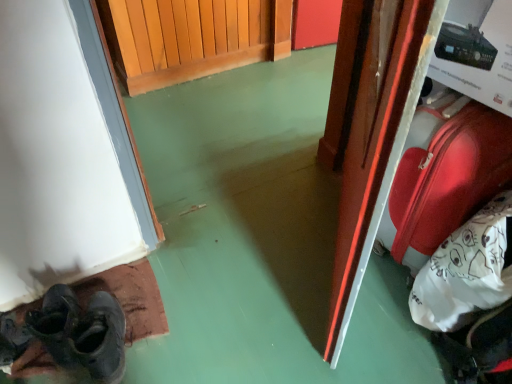
What do you see at coordinates (82, 332) in the screenshot?
I see `dark gray leather shoes at lower left` at bounding box center [82, 332].

Image resolution: width=512 pixels, height=384 pixels. What are the coordinates of `dark gray leather shoe at lower left` in the screenshot? It's located at (101, 338).

Would you say shiny red suitcase at right is a long distance from glossy wood door at right?

No, shiny red suitcase at right is in close proximity to glossy wood door at right.

Does point (418, 223) lie behind point (365, 188)?

Yes, it is.

Considering the sizes of shiny red suitcase at right and glossy wood door at right in the image, is shiny red suitcase at right wider or thinner than glossy wood door at right?

Considering their sizes, shiny red suitcase at right looks broader than glossy wood door at right.

Is dark gray leather shoe at lower left bigger or smaller than dark gray leather shoes at lower left?

Clearly, dark gray leather shoe at lower left is larger in size than dark gray leather shoes at lower left.

Considering the sizes of objects dark gray leather shoe at lower left and dark gray leather shoes at lower left in the image provided, who is wider, dark gray leather shoe at lower left or dark gray leather shoes at lower left?

With larger width is dark gray leather shoes at lower left.

From the image's perspective, which is below, dark gray leather shoe at lower left or dark gray leather shoes at lower left?

dark gray leather shoe at lower left.

From a real-world perspective, is dark gray leather shoe at lower left positioned over dark gray leather shoes at lower left based on gravity?

No.

Which object is positioned more to the right, glossy wood door at right or dark gray leather shoe at lower left?

Positioned to the right is glossy wood door at right.

Does glossy wood door at right turn towards dark gray leather shoe at lower left?

No, glossy wood door at right is not oriented towards dark gray leather shoe at lower left.

Which object is further away from the camera, glossy wood door at right or dark gray leather shoe at lower left?

dark gray leather shoe at lower left.

Considering the relative sizes of glossy wood door at right and dark gray leather shoe at lower left in the image provided, is glossy wood door at right smaller than dark gray leather shoe at lower left?

No, glossy wood door at right is not smaller than dark gray leather shoe at lower left.

Which object is positioned more to the left, shiny red suitcase at right or dark gray leather shoe at lower left?

dark gray leather shoe at lower left is more to the left.

Is shiny red suitcase at right inside the boundaries of dark gray leather shoe at lower left, or outside?

shiny red suitcase at right cannot be found inside dark gray leather shoe at lower left.

Is there a large distance between shiny red suitcase at right and dark gray leather shoe at lower left?

Actually, shiny red suitcase at right and dark gray leather shoe at lower left are a little close together.

From their relative heights in the image, would you say shiny red suitcase at right is taller or shorter than dark gray leather shoe at lower left?

Clearly, shiny red suitcase at right is taller compared to dark gray leather shoe at lower left.

Is dark gray leather shoe at lower left further to the viewer compared to shiny red suitcase at right?

Yes, it is.

How distant is dark gray leather shoe at lower left from shiny red suitcase at right?

dark gray leather shoe at lower left is 38.86 inches away from shiny red suitcase at right.

Which is closer, (113,369) or (411,159)?

Clearly, point (113,369) is closer to the camera than point (411,159).

Between dark gray leather shoe at lower left and shiny red suitcase at right, which one has smaller width?

dark gray leather shoe at lower left.

From the image's perspective, between glossy wood door at right and shiny red suitcase at right, which one is located above?

From the image's view, glossy wood door at right is above.

Which of these two, glossy wood door at right or shiny red suitcase at right, stands shorter?

With less height is shiny red suitcase at right.

Does glossy wood door at right have a greater width compared to shiny red suitcase at right?

No.

Between glossy wood door at right and shiny red suitcase at right, which one has smaller size?

Smaller between the two is glossy wood door at right.

Would you say dark gray leather shoes at lower left is inside or outside shiny red suitcase at right?

dark gray leather shoes at lower left is not enclosed by shiny red suitcase at right.

Is dark gray leather shoes at lower left smaller than shiny red suitcase at right?

Indeed, dark gray leather shoes at lower left has a smaller size compared to shiny red suitcase at right.

Considering the positions of points (51, 302) and (430, 124), is point (51, 302) closer to camera compared to point (430, 124)?

No.

Where is `luggage that is below the glossy wood door at right (from the image's perspective)`? The image size is (512, 384). luggage that is below the glossy wood door at right (from the image's perspective) is located at coordinates (444, 174).

The width and height of the screenshot is (512, 384). There is a dark gray leather shoe at lower left. Identify the location of footwear above it (from a real-world perspective). (82, 332).

Considering their positions, is dark gray leather shoes at lower left positioned further to dark gray leather shoe at lower left than glossy wood door at right?

glossy wood door at right is further to dark gray leather shoe at lower left.

Looking at the image, which one is located further to dark gray leather shoe at lower left, shiny red suitcase at right or dark gray leather shoes at lower left?

Based on the image, shiny red suitcase at right appears to be further to dark gray leather shoe at lower left.

Based on their spatial positions, is glossy wood door at right or dark gray leather shoes at lower left closer to shiny red suitcase at right?

Based on the image, glossy wood door at right appears to be nearer to shiny red suitcase at right.

Based on their spatial positions, is glossy wood door at right or dark gray leather shoe at lower left closer to shiny red suitcase at right?

Among the two, glossy wood door at right is located nearer to shiny red suitcase at right.

Which object lies nearer to the anchor point glossy wood door at right, dark gray leather shoes at lower left or dark gray leather shoe at lower left?

dark gray leather shoes at lower left lies closer to glossy wood door at right than the other object.

Looking at the image, which one is located closer to dark gray leather shoes at lower left, shiny red suitcase at right or dark gray leather shoe at lower left?

dark gray leather shoe at lower left.

Based on their spatial positions, is shiny red suitcase at right or glossy wood door at right closer to dark gray leather shoe at lower left?

glossy wood door at right.

Based on their spatial positions, is shiny red suitcase at right or glossy wood door at right further from dark gray leather shoes at lower left?

shiny red suitcase at right.

You are a GUI agent. You are given a task and a screenshot of the screen. Output one action in this format:
    pyautogui.click(x=<x>, y=<y>)
    Task: Click on the door between dark gray leather shoe at lower left and shiny red suitcase at right in the horizontal direction
    
    Given the screenshot: What is the action you would take?
    pyautogui.click(x=377, y=142)

The image size is (512, 384). Find the location of `shoe located between dark gray leather shoes at lower left and glossy wood door at right in the left-right direction`. shoe located between dark gray leather shoes at lower left and glossy wood door at right in the left-right direction is located at coordinates (101, 338).

At what (x,y) coordinates should I click in order to perform the action: click on door between dark gray leather shoes at lower left and shiny red suitcase at right from left to right. Please return your answer as a coordinate pair (x, y). This screenshot has height=384, width=512. Looking at the image, I should click on [377, 142].

At what (x,y) coordinates should I click in order to perform the action: click on shoe situated between dark gray leather shoes at lower left and shiny red suitcase at right from left to right. Please return your answer as a coordinate pair (x, y). Looking at the image, I should click on (101, 338).